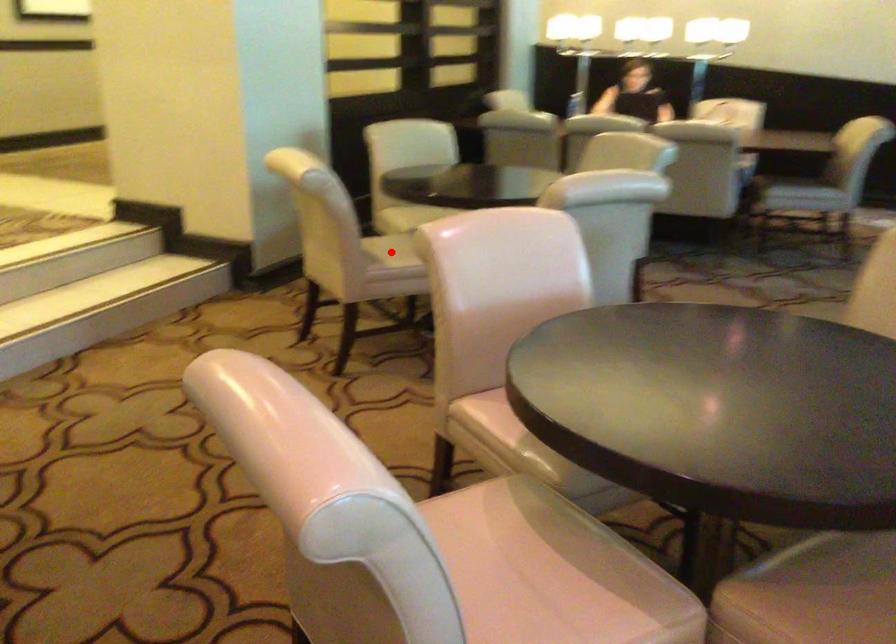
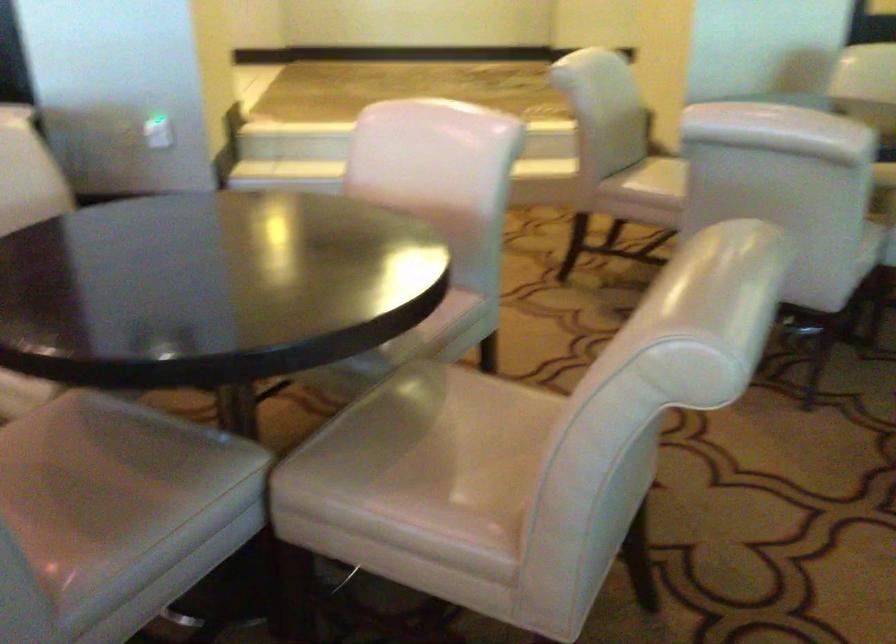
Question: I am providing you with two images of the same scene from different viewpoints. A red point is marked on the first image. At the location where the point appears in image 1, is it still visible in image 2?

Choices:
 (A) Yes
 (B) No

Answer: (B)